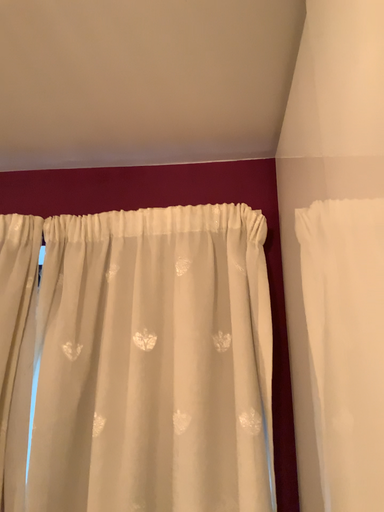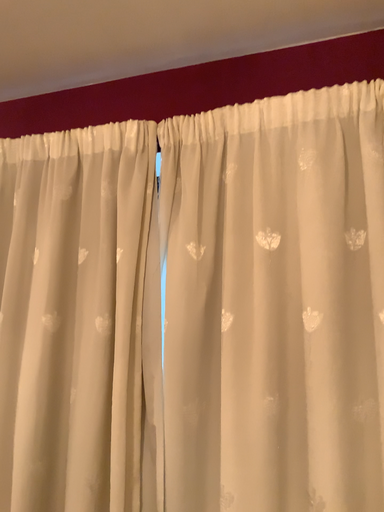
Question: How did the camera likely rotate when shooting the video?

Choices:
 (A) rotated downward
 (B) rotated upward

Answer: (A)